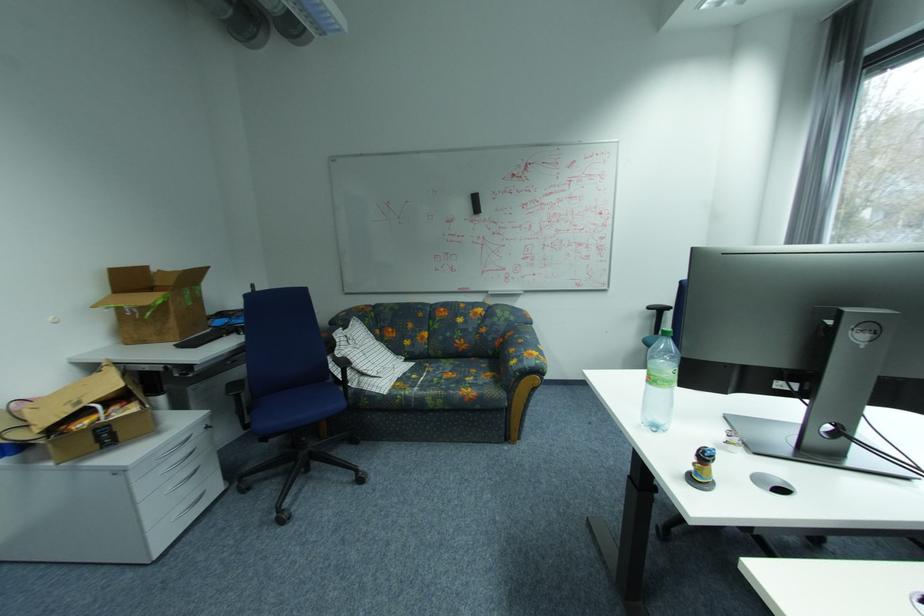
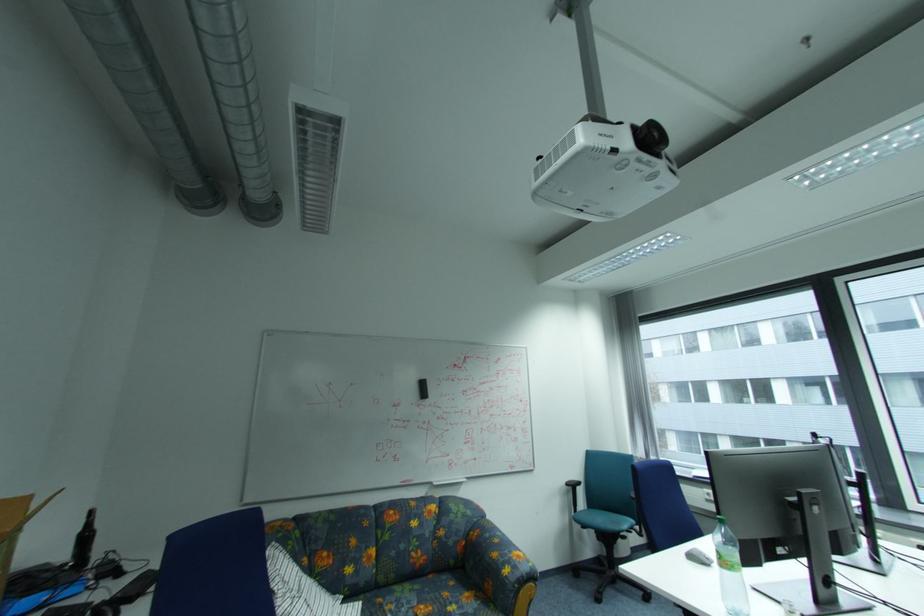
Where in the second image is the point corresponding to (x=476, y=206) from the first image?

(423, 391)